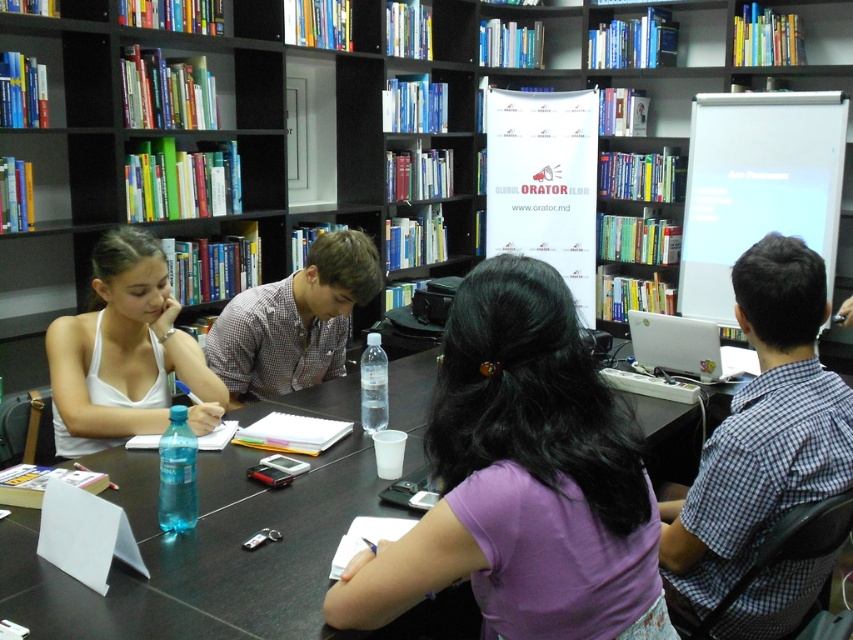
Question: Does purple cotton shirt at center have a lesser width compared to black plastic table at center?

Choices:
 (A) no
 (B) yes

Answer: (B)

Question: Which of the following is the closest to the observer?

Choices:
 (A) (338, 314)
 (B) (718, 340)
 (C) (120, 321)

Answer: (C)

Question: Which of the following is the closest to the observer?

Choices:
 (A) (196, 412)
 (B) (242, 602)

Answer: (B)

Question: Is purple cotton shirt at center above white matte tank top at left?

Choices:
 (A) yes
 (B) no

Answer: (B)

Question: Does white matte tank top at left appear on the right side of plaid fabric shirt at center?

Choices:
 (A) no
 (B) yes

Answer: (A)

Question: Which object appears farthest from the camera in this image?

Choices:
 (A) white matte tank top at left
 (B) black plastic table at center

Answer: (A)